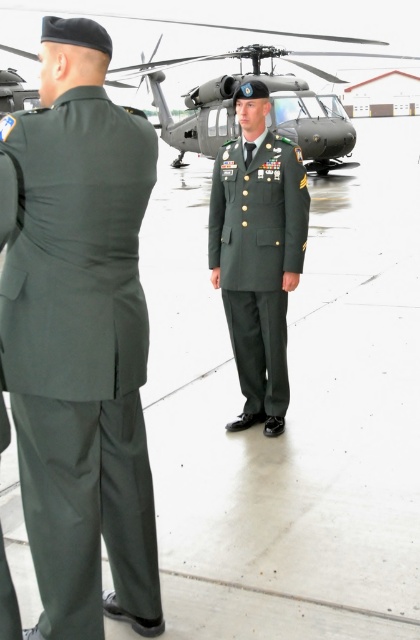
Describe the element at coordinates (81, 353) in the screenshot. I see `green fabric uniform at back` at that location.

Does green fabric uniform at back have a greater width compared to metallic gray helicopter at center?

No.

Between point (147, 200) and point (388, 81), which one is positioned behind?

Point (388, 81)

Identify the location of green fabric uniform at back. (81, 353).

In the scene shown: Does metallic gray helicopter at center have a smaller size compared to green matte uniform at center?

No, metallic gray helicopter at center is not smaller than green matte uniform at center.

Find the location of a particular element. The image size is (420, 640). metallic gray helicopter at center is located at coordinates (259, 74).

Which is in front, point (50, 372) or point (265, 161)?

Point (50, 372) is more forward.

Which of these two, green fabric uniform at back or green matte uniform at center, stands taller?

With more height is green matte uniform at center.

Locate an element on the screen. green fabric uniform at back is located at coordinates (81, 353).